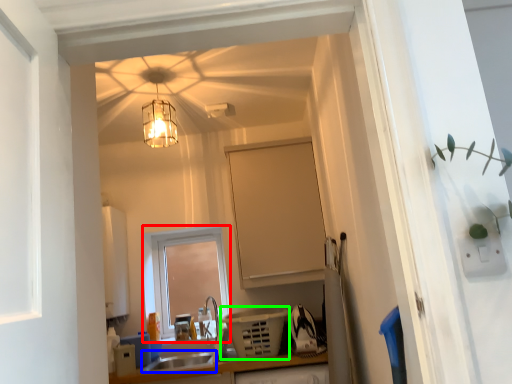
Question: Based on their relative distances, which object is farther from window (highlighted by a red box)? Choose from sink (highlighted by a blue box) and appliance (highlighted by a green box).

Choices:
 (A) sink
 (B) appliance

Answer: (B)